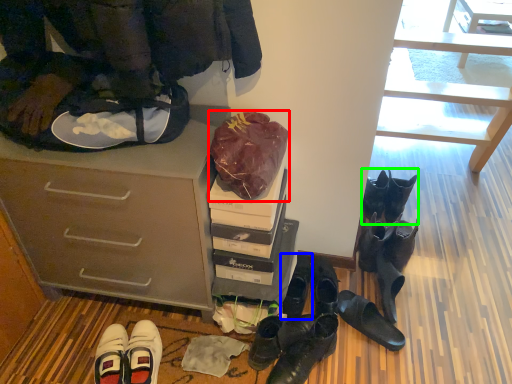
Question: Considering the real-world distances, which object is closest to bag (highlighted by a red box)? footwear (highlighted by a blue box) or footwear (highlighted by a green box).

Choices:
 (A) footwear
 (B) footwear

Answer: (A)